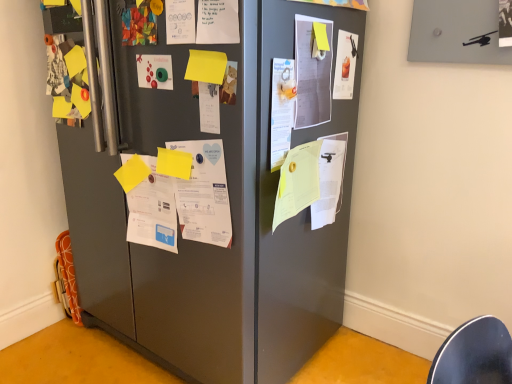
Question: From the image's perspective, is yellow matte paper at upper center, the third paper in the right-to-left sequence, on white paper at center, placed as the 5th poster when sorted from left to right?

Choices:
 (A) yes
 (B) no

Answer: (B)

Question: From a real-world perspective, is yellow matte paper at upper center, the third paper in the right-to-left sequence, on top of white paper at center, placed as the 5th poster when sorted from left to right?

Choices:
 (A) yes
 (B) no

Answer: (B)

Question: Is yellow matte paper at upper center, the fourth paper viewed from the left, bigger than white paper at center, placed as the 5th poster when sorted from left to right?

Choices:
 (A) yes
 (B) no

Answer: (B)

Question: Does yellow matte paper at upper center, the third paper in the right-to-left sequence, have a greater height compared to white paper at center, the 4th poster from the right?

Choices:
 (A) no
 (B) yes

Answer: (A)

Question: Is yellow matte paper at upper center, the fourth paper viewed from the left, oriented away from white paper at center, the 4th poster from the right?

Choices:
 (A) yes
 (B) no

Answer: (B)

Question: Can you confirm if yellow matte paper at upper center, the fourth paper viewed from the left, is positioned to the left of white paper at center, the 4th poster from the right?

Choices:
 (A) no
 (B) yes

Answer: (B)

Question: Is white paper at center, placed as the third poster when sorted from right to left, in contact with white paper at center, arranged as the 2th poster when viewed from the right?

Choices:
 (A) yes
 (B) no

Answer: (B)

Question: Does white paper at center, placed as the third poster when sorted from right to left, appear on the left side of white paper at center, which appears as the seventh poster when viewed from the left?

Choices:
 (A) no
 (B) yes

Answer: (B)

Question: Considering the relative sizes of white paper at center, the sixth poster viewed from the left, and white paper at center, which appears as the seventh poster when viewed from the left, in the image provided, is white paper at center, the sixth poster viewed from the left, taller than white paper at center, which appears as the seventh poster when viewed from the left,?

Choices:
 (A) yes
 (B) no

Answer: (B)

Question: Is white paper at center, the sixth poster viewed from the left, positioned with its back to white paper at center, which appears as the seventh poster when viewed from the left?

Choices:
 (A) no
 (B) yes

Answer: (A)

Question: Can you confirm if white paper at center, the sixth poster viewed from the left, is positioned to the right of white paper at center, which appears as the seventh poster when viewed from the left?

Choices:
 (A) yes
 (B) no

Answer: (B)

Question: Does white paper at center, the sixth poster viewed from the left, have a greater width compared to white paper at center, which appears as the seventh poster when viewed from the left?

Choices:
 (A) no
 (B) yes

Answer: (A)

Question: Could you tell me if white paper at center, the sixth poster viewed from the left, is facing matte green button at center, acting as the eighth poster starting from the right?

Choices:
 (A) yes
 (B) no

Answer: (B)